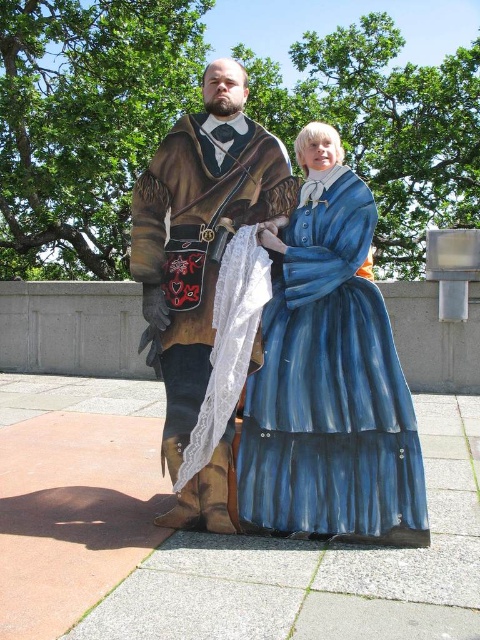
Is point (324, 230) positioned behind point (140, 220)?

That is False.

Is matte brown leather coat at center thinner than brown leather robe at center?

Incorrect, matte brown leather coat at center's width is not less than brown leather robe at center's.

At what (x,y) coordinates should I click in order to perform the action: click on matte brown leather coat at center. Please return your answer as a coordinate pair (x, y). Looking at the image, I should click on (328, 376).

Which is above, matte brown leather coat at center or blue satin dress at center?

matte brown leather coat at center

Does point (263, 424) come closer to viewer compared to point (285, 435)?

That is False.

Does point (402, 540) come farther from viewer compared to point (397, 378)?

That is False.

Locate an element on the screen. The height and width of the screenshot is (640, 480). matte brown leather coat at center is located at coordinates (328, 376).

Does blue satin dress at center come behind brown leather robe at center?

That is False.

Which of these two, blue satin dress at center or brown leather robe at center, stands taller?

brown leather robe at center is taller.

Is point (273, 358) less distant than point (214, 262)?

Yes, it is in front of point (214, 262).

Locate an element on the screen. blue satin dress at center is located at coordinates (330, 388).